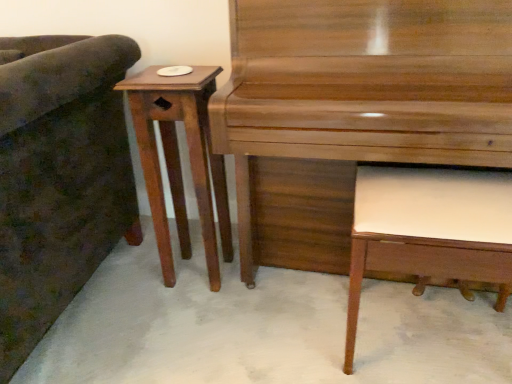
Question: Is mahogany wood side table at left a part of white leather music stool at lower right?

Choices:
 (A) yes
 (B) no

Answer: (B)

Question: Would you consider white leather music stool at lower right to be distant from mahogany wood side table at left?

Choices:
 (A) no
 (B) yes

Answer: (A)

Question: Can you confirm if white leather music stool at lower right is wider than mahogany wood side table at left?

Choices:
 (A) yes
 (B) no

Answer: (A)

Question: Could you tell me if white leather music stool at lower right is facing mahogany wood side table at left?

Choices:
 (A) yes
 (B) no

Answer: (B)

Question: Does white leather music stool at lower right lie behind mahogany wood side table at left?

Choices:
 (A) no
 (B) yes

Answer: (A)

Question: Is point (370, 249) positioned closer to the camera than point (72, 235)?

Choices:
 (A) farther
 (B) closer

Answer: (B)

Question: Considering their positions, is white leather music stool at lower right located in front of or behind dark green fabric couch at left?

Choices:
 (A) front
 (B) behind

Answer: (B)

Question: In terms of height, does white leather music stool at lower right look taller or shorter compared to dark green fabric couch at left?

Choices:
 (A) short
 (B) tall

Answer: (A)

Question: In terms of width, does white leather music stool at lower right look wider or thinner when compared to dark green fabric couch at left?

Choices:
 (A) wide
 (B) thin

Answer: (B)

Question: From a real-world perspective, is shiny brown piano at center positioned above or below white leather music stool at lower right?

Choices:
 (A) above
 (B) below

Answer: (A)

Question: Visually, is shiny brown piano at center positioned to the left or to the right of white leather music stool at lower right?

Choices:
 (A) right
 (B) left

Answer: (B)

Question: Considering the positions of shiny brown piano at center and white leather music stool at lower right in the image, is shiny brown piano at center wider or thinner than white leather music stool at lower right?

Choices:
 (A) thin
 (B) wide

Answer: (B)

Question: Is shiny brown piano at center bigger or smaller than white leather music stool at lower right?

Choices:
 (A) small
 (B) big

Answer: (B)

Question: Is shiny brown piano at center wider or thinner than mahogany wood side table at left?

Choices:
 (A) wide
 (B) thin

Answer: (A)

Question: Considering their positions, is shiny brown piano at center located in front of or behind mahogany wood side table at left?

Choices:
 (A) front
 (B) behind

Answer: (A)